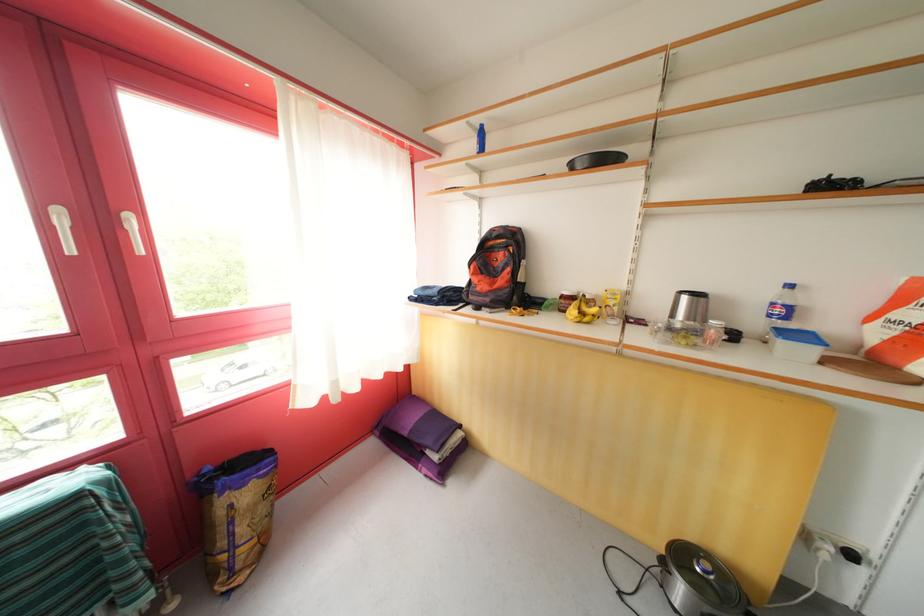
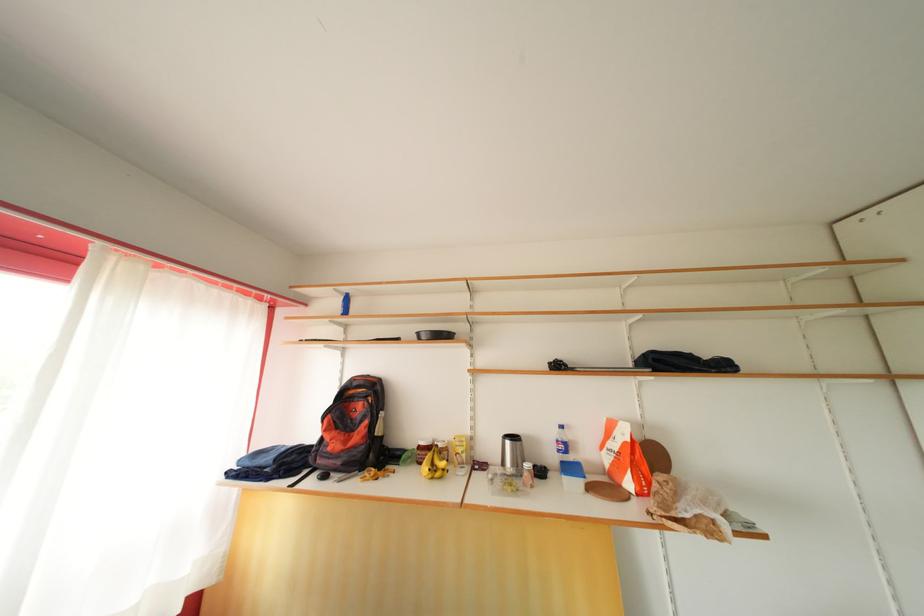
Locate, in the second image, the point that corresponds to (x=578, y=172) in the first image.

(426, 341)